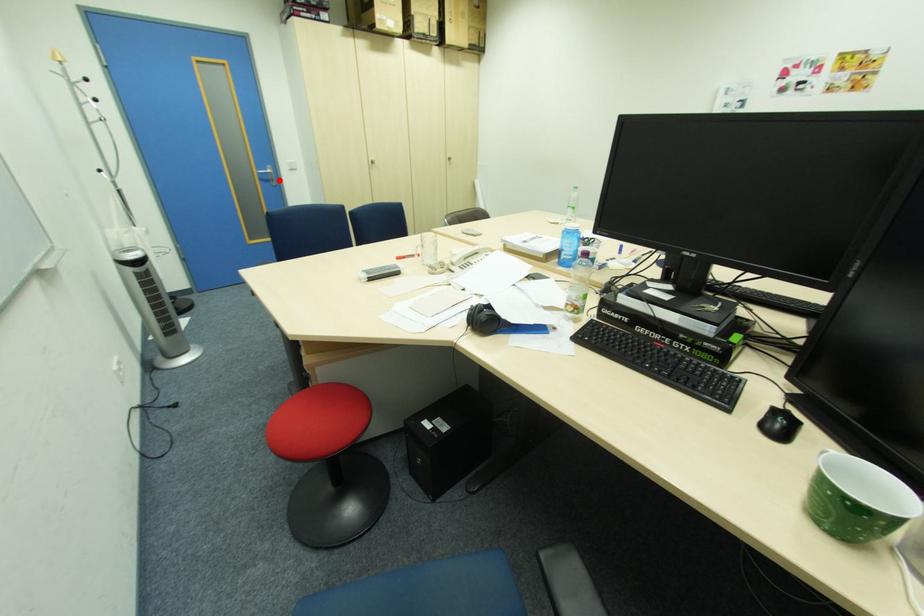
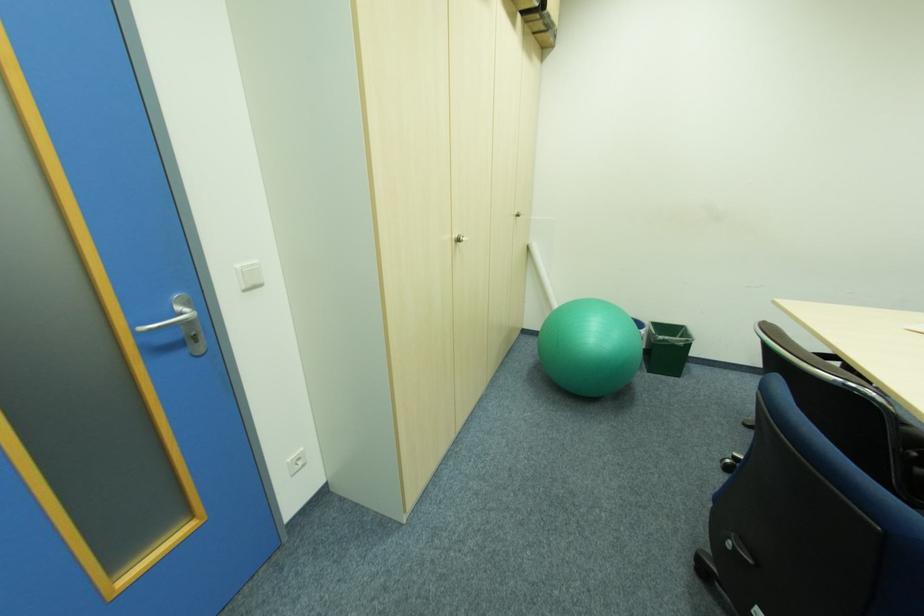
Question: I am providing you with two images of the same scene from different viewpoints. Given a red point in image1, look at the same physical point in image2. Is it:

Choices:
 (A) Closer to the viewpoint
 (B) Farther from the viewpoint

Answer: (B)